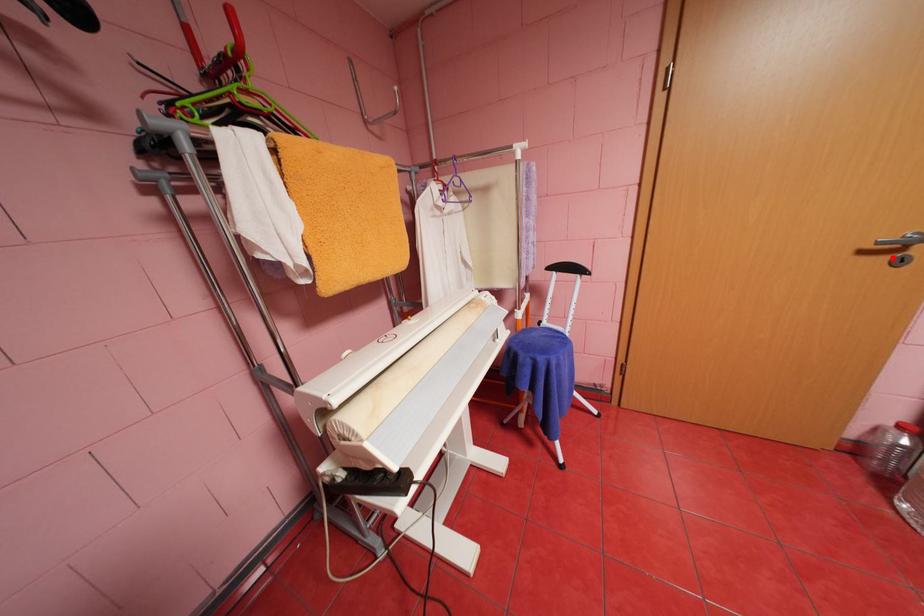
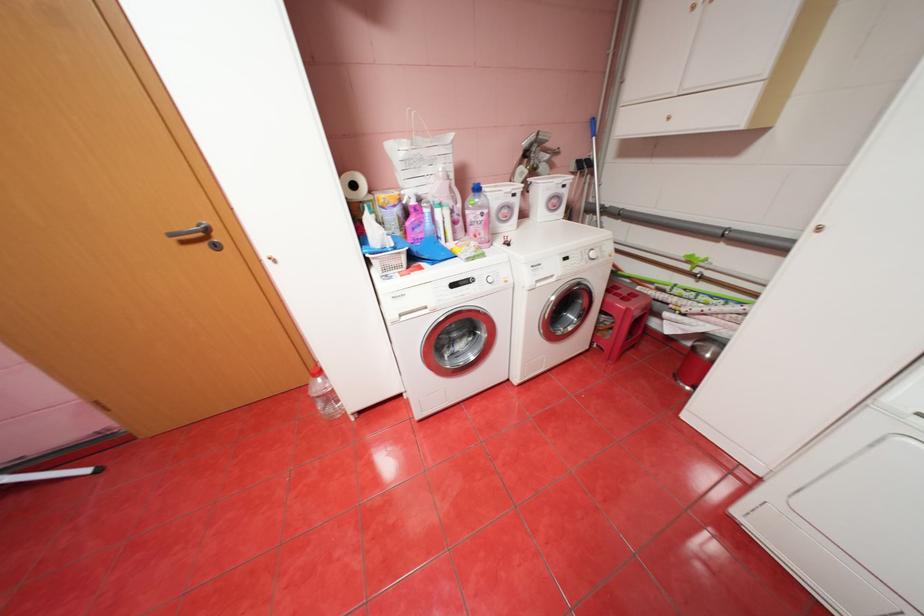
Question: I am providing you with two images of the same scene from different viewpoints. Image1 has a red point marked. In image2, the corresponding 3D location appears at what relative position? Reply with the corresponding letter.

Choices:
 (A) Closer
 (B) Farther

Answer: (A)